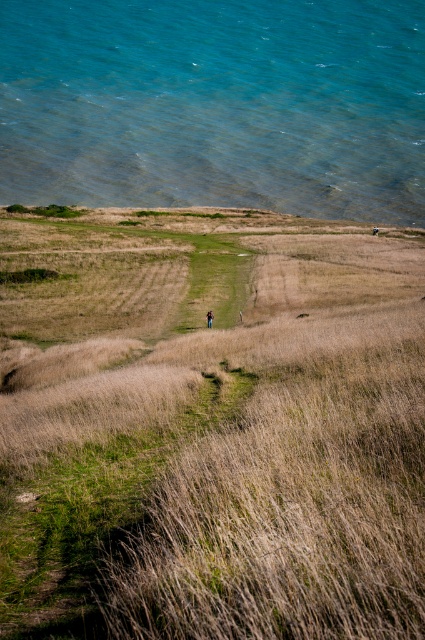
Is point (354, 186) positioned in front of point (210, 323)?

No, (354, 186) is further to viewer.

Is clear blue water at upper left above brown leather backpack at center?

Indeed, clear blue water at upper left is positioned over brown leather backpack at center.

Does point (215, 118) come farther from viewer compared to point (212, 314)?

Yes.

Where is `clear blue water at upper left`? The width and height of the screenshot is (425, 640). clear blue water at upper left is located at coordinates (215, 104).

Is dry grass at center to the right of brown leather backpack at center from the viewer's perspective?

Yes, dry grass at center is to the right of brown leather backpack at center.

Who is higher up, dry grass at center or brown leather backpack at center?

dry grass at center is above.

Which is behind, point (342, 634) or point (207, 310)?

Positioned behind is point (207, 310).

Identify the location of dry grass at center. (210, 426).

Can you confirm if dry grass at center is positioned to the left of clear blue water at upper left?

Indeed, dry grass at center is positioned on the left side of clear blue water at upper left.

Between dry grass at center and clear blue water at upper left, which one is positioned lower?

dry grass at center is lower down.

What do you see at coordinates (210, 426) in the screenshot?
I see `dry grass at center` at bounding box center [210, 426].

Locate an element on the screen. The image size is (425, 640). dry grass at center is located at coordinates (210, 426).